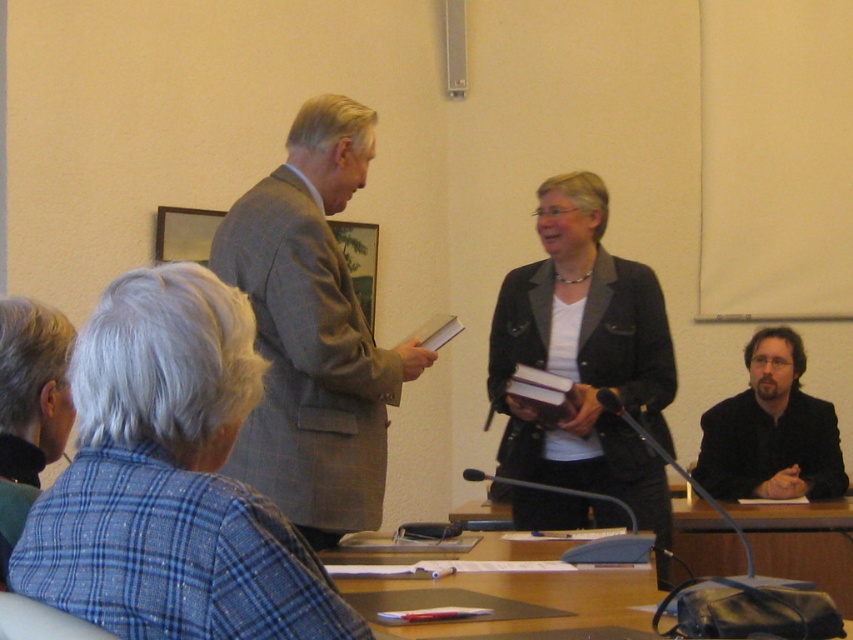
Who is higher up, gray wool suit at upper center or dark brown suit at lower right?

gray wool suit at upper center

From the picture: Is gray wool suit at upper center thinner than dark brown suit at lower right?

Yes, gray wool suit at upper center is thinner than dark brown suit at lower right.

Find the location of a particular element. The image size is (853, 640). gray wool suit at upper center is located at coordinates (170, 481).

Does point (332, 104) come behind point (42, 332)?

Yes, point (332, 104) is farther from viewer.

The width and height of the screenshot is (853, 640). Find the location of `gray textured suit at center`. gray textured suit at center is located at coordinates (312, 332).

Measure the distance between gray wool suit at upper center and wooden table at lower center.

They are 2.39 meters apart.

Describe the element at coordinates (170, 481) in the screenshot. This screenshot has height=640, width=853. I see `gray wool suit at upper center` at that location.

You are a GUI agent. You are given a task and a screenshot of the screen. Output one action in this format:
    pyautogui.click(x=<x>, y=<y>)
    Task: Click on the gray wool suit at upper center
    
    Given the screenshot: What is the action you would take?
    pyautogui.click(x=170, y=481)